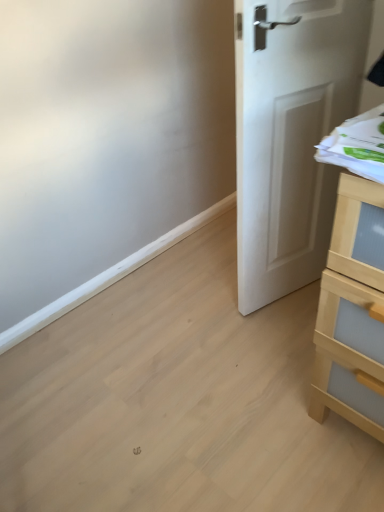
Identify the location of white matte door at center. (290, 135).

What is the approximate height of white matte door at center?

It is 1.04 meters.

Describe the element at coordinates (290, 135) in the screenshot. This screenshot has width=384, height=512. I see `white matte door at center` at that location.

This screenshot has width=384, height=512. In order to click on light wood chest of drawers at right in this screenshot , I will do `click(352, 312)`.

Describe the element at coordinates (352, 312) in the screenshot. I see `light wood chest of drawers at right` at that location.

Where is `white matte door at center`? The image size is (384, 512). white matte door at center is located at coordinates (290, 135).

Visually, is white matte door at center positioned to the left or to the right of light wood chest of drawers at right?

From the image, it's evident that white matte door at center is to the left of light wood chest of drawers at right.

Does white matte door at center lie in front of light wood chest of drawers at right?

No, it is behind light wood chest of drawers at right.

Which is closer to the camera, [252,264] or [364,407]?

Point [252,264] is farther from the camera than point [364,407].

From the image's perspective, does white matte door at center appear higher than light wood chest of drawers at right?

Yes.

From a real-world perspective, is white matte door at center physically located above or below light wood chest of drawers at right?

white matte door at center is above light wood chest of drawers at right.

Can you confirm if white matte door at center is thinner than light wood chest of drawers at right?

Correct, the width of white matte door at center is less than that of light wood chest of drawers at right.

Between white matte door at center and light wood chest of drawers at right, which one has more height?

With more height is white matte door at center.

Between white matte door at center and light wood chest of drawers at right, which one has smaller size?

Smaller between the two is white matte door at center.

Is white matte door at center spatially inside light wood chest of drawers at right, or outside of it?

white matte door at center cannot be found inside light wood chest of drawers at right.

Based on the photo, is white matte door at center far from light wood chest of drawers at right?

No, white matte door at center is in close proximity to light wood chest of drawers at right.

In the scene shown: Could you tell me if white matte door at center is turned towards light wood chest of drawers at right?

No.

Measure the distance from white matte door at center to light wood chest of drawers at right.

They are 21.47 inches apart.

What are the coordinates of `chest of drawers below the white matte door at center (from a real-world perspective)` in the screenshot? It's located at (352, 312).

Is light wood chest of drawers at right to the left or to the right of white matte door at center in the image?

Based on their positions, light wood chest of drawers at right is located to the right of white matte door at center.

Which object is closer to the camera taking this photo, light wood chest of drawers at right or white matte door at center?

light wood chest of drawers at right is closer to the camera.

Between point (383, 264) and point (282, 265), which one is positioned in front?

Positioned in front is point (383, 264).

From the image's perspective, is light wood chest of drawers at right on white matte door at center?

No, from the image's perspective, light wood chest of drawers at right is not over white matte door at center.

From a real-world perspective, between light wood chest of drawers at right and white matte door at center, who is vertically lower?

light wood chest of drawers at right is physically lower.

Which object is thinner, light wood chest of drawers at right or white matte door at center?

white matte door at center.

Does light wood chest of drawers at right have a lesser height compared to white matte door at center?

Yes.

Between light wood chest of drawers at right and white matte door at center, which one has smaller size?

white matte door at center is smaller.

Is light wood chest of drawers at right inside the boundaries of white matte door at center, or outside?

light wood chest of drawers at right lies outside white matte door at center.

Is light wood chest of drawers at right not close to white matte door at center?

light wood chest of drawers at right is actually quite close to white matte door at center.

Could you tell me if light wood chest of drawers at right is facing white matte door at center?

No.

What's the angular difference between light wood chest of drawers at right and white matte door at center's facing directions?

104 degrees separate the facing orientations of light wood chest of drawers at right and white matte door at center.

You are a GUI agent. You are given a task and a screenshot of the screen. Output one action in this format:
    pyautogui.click(x=<x>, y=<y>)
    Task: Click on the door that is above the light wood chest of drawers at right (from the image's perspective)
    Image resolution: width=384 pixels, height=512 pixels.
    Given the screenshot: What is the action you would take?
    pyautogui.click(x=290, y=135)

At what (x,y) coordinates should I click in order to perform the action: click on chest of drawers on the right side of white matte door at center. Please return your answer as a coordinate pair (x, y). Looking at the image, I should click on (352, 312).

This screenshot has width=384, height=512. Identify the location of door above the light wood chest of drawers at right (from the image's perspective). (290, 135).